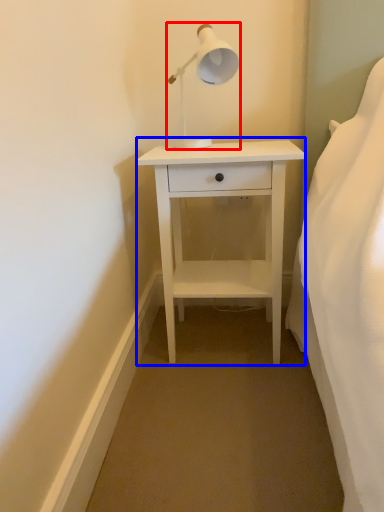
Question: Which of the following is the closest to the observer, lamp (highlighted by a red box) or nightstand (highlighted by a blue box)?

Choices:
 (A) lamp
 (B) nightstand

Answer: (A)